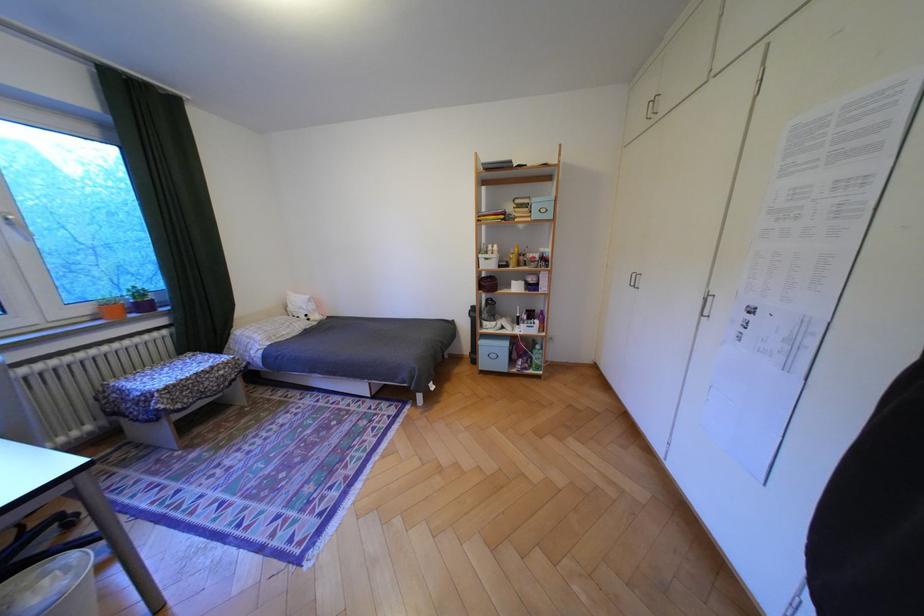
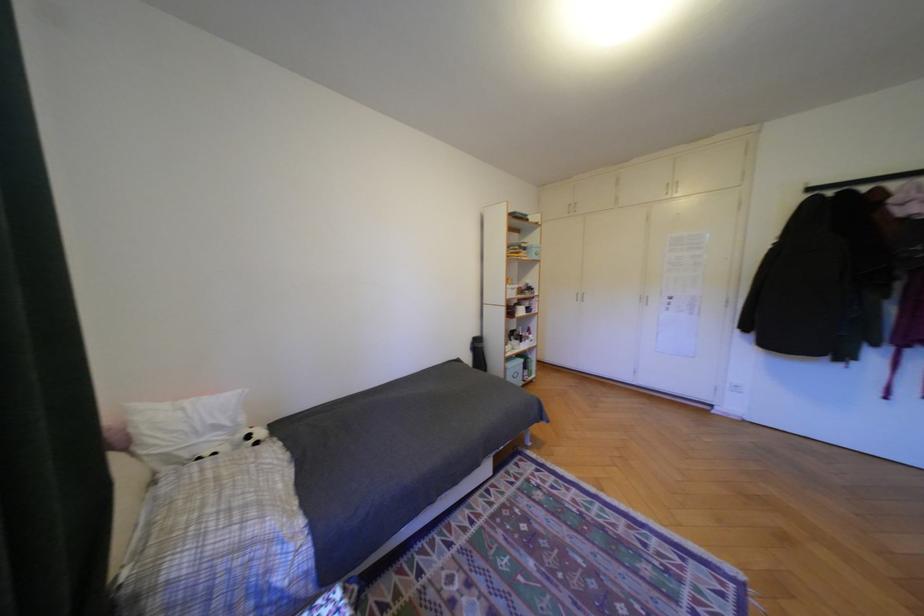
The point at (x=313, y=308) is marked in the first image. Where is the corresponding point in the second image?

(228, 427)